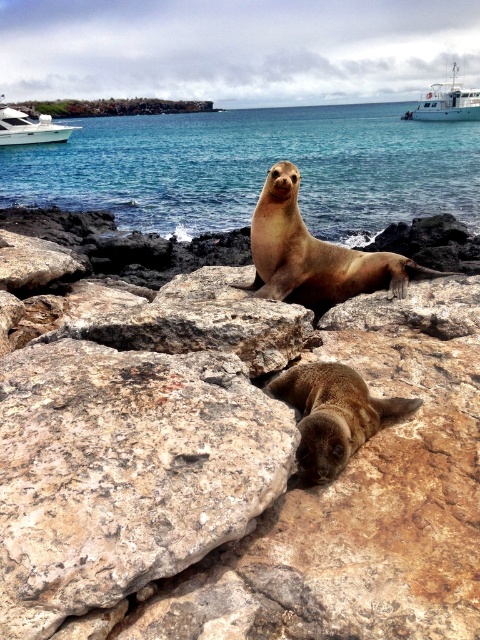
Question: Is white plastic boat at upper right to the left of white glossy boat at upper left from the viewer's perspective?

Choices:
 (A) yes
 (B) no

Answer: (B)

Question: Among these objects, which one is nearest to the camera?

Choices:
 (A) white plastic boat at upper right
 (B) rough textured rock at center

Answer: (B)

Question: Is green mossy rocks at upper center above white glossy boat at upper left?

Choices:
 (A) yes
 (B) no

Answer: (A)

Question: Does blue water at center appear on the right side of white glossy boat at upper left?

Choices:
 (A) no
 (B) yes

Answer: (B)

Question: Which object appears farthest from the camera in this image?

Choices:
 (A) green mossy rocks at upper center
 (B) brown rough rock at center
 (C) rough textured rock at center

Answer: (A)

Question: Estimate the real-world distances between objects in this image. Which object is farther from the rough textured rock at center?

Choices:
 (A) brown rough rock at center
 (B) white plastic boat at upper right

Answer: (B)